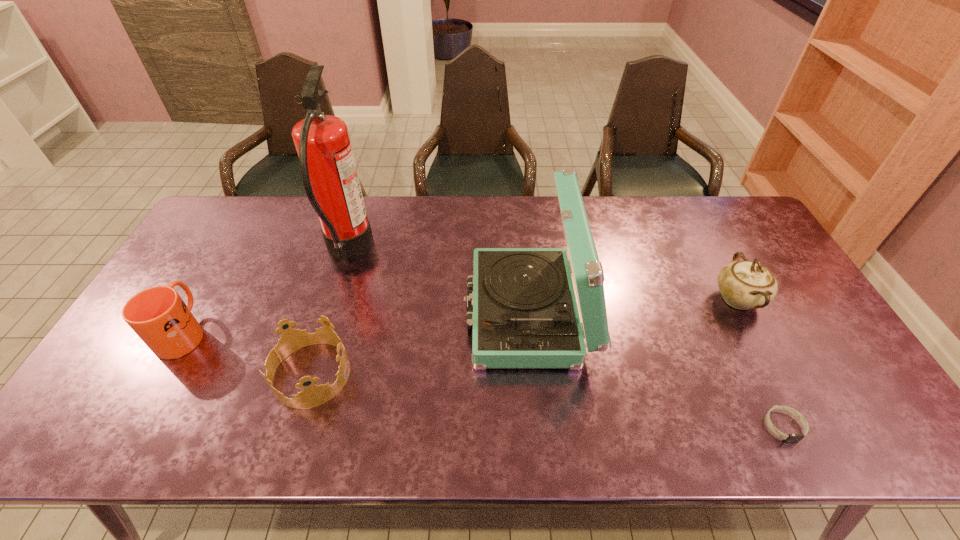
This screenshot has width=960, height=540. What are the coordinates of `free space located on the face side of the second tallest object` in the screenshot? It's located at (351, 313).

Find the location of a particular element. This screenshot has width=960, height=540. vacant space located on the face side of the second tallest object is located at coordinates (369, 313).

Where is `free space located 0.210m on the left of the chinaware`? The image size is (960, 540). free space located 0.210m on the left of the chinaware is located at coordinates (639, 299).

You are a GUI agent. You are given a task and a screenshot of the screen. Output one action in this format:
    pyautogui.click(x=<x>, y=<y>)
    Task: Click on the vacant space located 0.310m on the handle side of the mug
    Image resolution: width=960 pixels, height=540 pixels.
    Given the screenshot: What is the action you would take?
    pyautogui.click(x=239, y=237)

Where is `vacant space situated 0.330m on the handle side of the mug`? Image resolution: width=960 pixels, height=540 pixels. vacant space situated 0.330m on the handle side of the mug is located at coordinates (242, 233).

Identify the location of vacant region located 0.320m on the handle side of the mug. The height and width of the screenshot is (540, 960). (240, 234).

Image resolution: width=960 pixels, height=540 pixels. Find the location of `free spot located on the front-facing side of the second shortest object`. free spot located on the front-facing side of the second shortest object is located at coordinates (381, 374).

You are a GUI agent. You are given a task and a screenshot of the screen. Output one action in this format:
    pyautogui.click(x=<x>, y=<y>)
    Task: Click on the object that is positioned at the far edge
    The image size is (960, 540).
    Given the screenshot: What is the action you would take?
    pyautogui.click(x=328, y=170)

You are a GUI agent. You are given a task and a screenshot of the screen. Output one action in this format:
    pyautogui.click(x=<x>, y=<y>)
    Task: Click on the object located in the near edge section of the desktop
    
    Given the screenshot: What is the action you would take?
    pyautogui.click(x=791, y=437)

The image size is (960, 540). I want to click on object at the left edge, so click(158, 315).